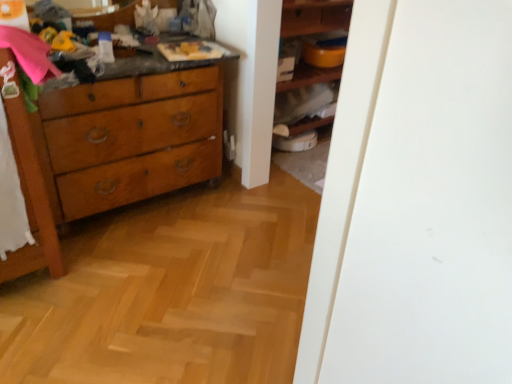
Question: Considering the relative sizes of wooden shelves at center and wooden dresser at left in the image provided, is wooden shelves at center taller than wooden dresser at left?

Choices:
 (A) yes
 (B) no

Answer: (B)

Question: From a real-world perspective, is wooden shelves at center below wooden dresser at left?

Choices:
 (A) yes
 (B) no

Answer: (A)

Question: Considering the relative sizes of wooden shelves at center and wooden dresser at left in the image provided, is wooden shelves at center bigger than wooden dresser at left?

Choices:
 (A) yes
 (B) no

Answer: (B)

Question: From the image's perspective, is wooden shelves at center below wooden dresser at left?

Choices:
 (A) no
 (B) yes

Answer: (A)

Question: Is wooden shelves at center far away from wooden dresser at left?

Choices:
 (A) yes
 (B) no

Answer: (A)

Question: From a real-world perspective, is wooden cabinet at center positioned above or below wooden shelves at center?

Choices:
 (A) below
 (B) above

Answer: (A)

Question: Considering their positions, is wooden cabinet at center located in front of or behind wooden shelves at center?

Choices:
 (A) behind
 (B) front

Answer: (A)

Question: In terms of width, does wooden cabinet at center look wider or thinner when compared to wooden shelves at center?

Choices:
 (A) wide
 (B) thin

Answer: (B)

Question: Choose the correct answer: Is wooden cabinet at center inside wooden shelves at center or outside it?

Choices:
 (A) outside
 (B) inside

Answer: (B)

Question: Considering the positions of wooden dresser at left and wooden cabinet at center in the image, is wooden dresser at left taller or shorter than wooden cabinet at center?

Choices:
 (A) short
 (B) tall

Answer: (B)

Question: Considering the positions of wooden dresser at left and wooden cabinet at center in the image, is wooden dresser at left wider or thinner than wooden cabinet at center?

Choices:
 (A) wide
 (B) thin

Answer: (A)

Question: Is point (117, 92) closer or farther from the camera than point (310, 109)?

Choices:
 (A) farther
 (B) closer

Answer: (B)

Question: From a real-world perspective, is wooden dresser at left physically located above or below wooden cabinet at center?

Choices:
 (A) above
 (B) below

Answer: (A)

Question: From the image's perspective, is wooden dresser at left positioned above or below wooden shelves at center?

Choices:
 (A) below
 (B) above

Answer: (A)

Question: From a real-world perspective, is wooden dresser at left above or below wooden shelves at center?

Choices:
 (A) above
 (B) below

Answer: (A)